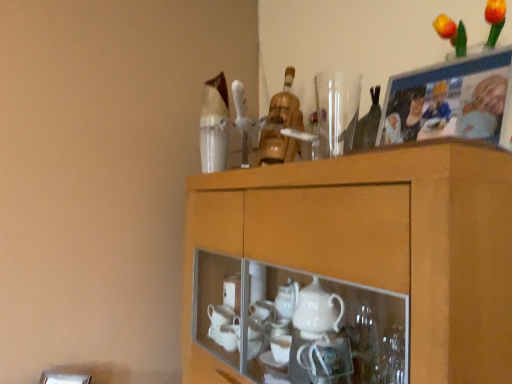
Question: Considering the relative positions of transparent glass vase at upper center and wooden cabinet at upper center in the image provided, is transparent glass vase at upper center to the right of wooden cabinet at upper center from the viewer's perspective?

Choices:
 (A) yes
 (B) no

Answer: (A)

Question: Is transparent glass vase at upper center turned away from wooden cabinet at upper center?

Choices:
 (A) no
 (B) yes

Answer: (A)

Question: Could you tell me if transparent glass vase at upper center is turned towards wooden cabinet at upper center?

Choices:
 (A) no
 (B) yes

Answer: (A)

Question: Does transparent glass vase at upper center appear on the left side of wooden cabinet at upper center?

Choices:
 (A) yes
 (B) no

Answer: (B)

Question: Does transparent glass vase at upper center touch wooden cabinet at upper center?

Choices:
 (A) yes
 (B) no

Answer: (B)

Question: Is transparent glass vase at upper center outside of wooden cabinet at upper center?

Choices:
 (A) no
 (B) yes

Answer: (B)

Question: Considering the relative sizes of wooden photo frame at upper right and wooden cabinet at upper center in the image provided, is wooden photo frame at upper right thinner than wooden cabinet at upper center?

Choices:
 (A) no
 (B) yes

Answer: (B)

Question: Does wooden photo frame at upper right have a lesser height compared to wooden cabinet at upper center?

Choices:
 (A) no
 (B) yes

Answer: (B)

Question: From the image's perspective, would you say wooden photo frame at upper right is positioned over wooden cabinet at upper center?

Choices:
 (A) yes
 (B) no

Answer: (A)

Question: Is wooden photo frame at upper right positioned before wooden cabinet at upper center?

Choices:
 (A) no
 (B) yes

Answer: (A)

Question: Is wooden photo frame at upper right to the left of wooden cabinet at upper center from the viewer's perspective?

Choices:
 (A) no
 (B) yes

Answer: (A)

Question: Is wooden photo frame at upper right not inside wooden cabinet at upper center?

Choices:
 (A) yes
 (B) no

Answer: (A)

Question: Does transparent glass vase at upper center turn towards wooden photo frame at upper right?

Choices:
 (A) yes
 (B) no

Answer: (B)